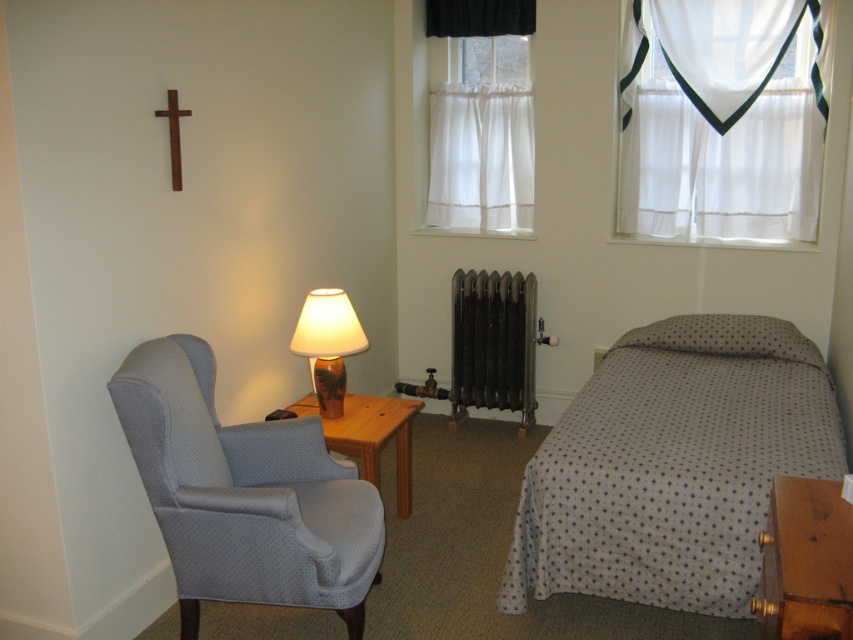
You are planning to place a new bed in the bedroom. The current bed is the white dotted fabric bed at right. You want to replace it with a bed that is the same size as the sheer white curtains at upper right. Based on the scene description, will the new bed fit in the space where the current bed is located?

The white dotted fabric bed at right is larger in width than the sheer white curtains at upper right. Since the new bed would be the same size as the curtains, it would be smaller and therefore fit in the current space.

You are standing in the bedroom and want to place a new picture frame on the closest object to you between the sheer white curtains at upper right and the gray dotted pillow at right. Which object should you choose?

The gray dotted pillow at right is closer to you than the sheer white curtains at upper right, so you should place the picture frame on the gray dotted pillow at right.

You are standing in the bedroom and want to move from the white dotted fabric bed at right to the sheer white curtains at upper right. Which direction should you move in relation to the bed?

The white dotted fabric bed at right is positioned on the left side of sheer white curtains at upper right, so you should move to the right relative to the bed to reach the sheer white curtains at upper right.